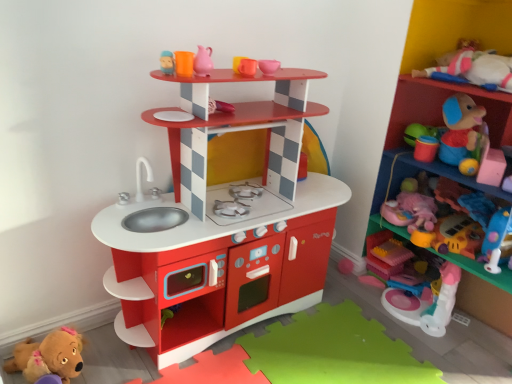
The image size is (512, 384). What do you see at coordinates (385, 254) in the screenshot? I see `translucent pink plastic blocks at lower right, which is the third toy in top-to-bottom order` at bounding box center [385, 254].

The image size is (512, 384). Find the location of `plastic toy at upper right, the 2th shelf viewed from the left`. plastic toy at upper right, the 2th shelf viewed from the left is located at coordinates (436, 126).

Describe the element at coordinates (203, 61) in the screenshot. This screenshot has height=384, width=512. I see `pink rubber jug at upper center, positioned as the 2th toy in left-to-right order` at that location.

Locate an element on the screen. The height and width of the screenshot is (384, 512). brown plush toy at lower left, placed as the 5th toy when sorted from right to left is located at coordinates (49, 356).

Locate an element on the screen. Image resolution: width=512 pixels, height=384 pixels. translucent pink plastic blocks at lower right, positioned as the third toy in bottom-to-top order is located at coordinates (385, 254).

Is matte plastic shelf at upper center, which is counted as the first shelf, starting from the left, further to the viewer compared to brown plush toy at lower left, placed as the 5th toy when sorted from right to left?

No.

Is matte plastic shelf at upper center, which is counted as the first shelf, starting from the left, not close to brown plush toy at lower left, placed as the 5th toy when sorted from right to left?

No, matte plastic shelf at upper center, which is counted as the first shelf, starting from the left, is in close proximity to brown plush toy at lower left, placed as the 5th toy when sorted from right to left.

Does matte plastic shelf at upper center, which is counted as the first shelf, starting from the left, have a smaller size compared to brown plush toy at lower left, the 1th toy when ordered from left to right?

Actually, matte plastic shelf at upper center, which is counted as the first shelf, starting from the left, might be larger than brown plush toy at lower left, the 1th toy when ordered from left to right.

Is translucent pink plastic blocks at lower right, arranged as the 4th toy when viewed from the left, facing towards brown plush toy at lower left, placed as the 5th toy when sorted from top to bottom?

No, translucent pink plastic blocks at lower right, arranged as the 4th toy when viewed from the left, is not oriented towards brown plush toy at lower left, placed as the 5th toy when sorted from top to bottom.

Does translucent pink plastic blocks at lower right, which is the 2th toy in right-to-left order, have a larger size compared to brown plush toy at lower left, which ranks as the first toy in bottom-to-top order?

No.

Considering the points (384, 274) and (26, 366), which point is behind, point (384, 274) or point (26, 366)?

Point (384, 274)

Could brown plush toy at lower left, the 1th toy when ordered from left to right, be considered to be inside translucent pink plastic blocks at lower right, which is the 2th toy in right-to-left order?

No, brown plush toy at lower left, the 1th toy when ordered from left to right, is not a part of translucent pink plastic blocks at lower right, which is the 2th toy in right-to-left order.

Can you tell me how much brown plush toy at lower left, placed as the 5th toy when sorted from right to left, and plastic toy at upper right, the 1th shelf positioned from the right, differ in facing direction?

0.815 degrees.

From a real-world perspective, is brown plush toy at lower left, which ranks as the first toy in bottom-to-top order, on plastic toy at upper right, the 2th shelf viewed from the left?

No, from a real-world perspective, brown plush toy at lower left, which ranks as the first toy in bottom-to-top order, is not over plastic toy at upper right, the 2th shelf viewed from the left

From the picture: Is plastic toy at upper right, the 2th shelf viewed from the left, inside brown plush toy at lower left, placed as the 5th toy when sorted from top to bottom?

No, plastic toy at upper right, the 2th shelf viewed from the left, is not inside brown plush toy at lower left, placed as the 5th toy when sorted from top to bottom.

Measure the distance from brown plush toy at lower left, which ranks as the first toy in bottom-to-top order, to plastic toy at upper right, the 1th shelf positioned from the right.

A distance of 4.98 feet exists between brown plush toy at lower left, which ranks as the first toy in bottom-to-top order, and plastic toy at upper right, the 1th shelf positioned from the right.

How different are the orientations of pink rubber jug at upper center, positioned as the 2th toy in left-to-right order, and plastic toy at upper right, the 2th shelf viewed from the left, in degrees?

The facing directions of pink rubber jug at upper center, positioned as the 2th toy in left-to-right order, and plastic toy at upper right, the 2th shelf viewed from the left, are 2.1 degrees apart.

Who is more distant, pink rubber jug at upper center, positioned as the 5th toy in bottom-to-top order, or plastic toy at upper right, the 1th shelf positioned from the right?

pink rubber jug at upper center, positioned as the 5th toy in bottom-to-top order, is more distant.

Is plastic toy at upper right, the 2th shelf viewed from the left, surrounded by pink rubber jug at upper center, positioned as the 5th toy in bottom-to-top order?

Definitely not — plastic toy at upper right, the 2th shelf viewed from the left, is not inside pink rubber jug at upper center, positioned as the 5th toy in bottom-to-top order.

What's the angular difference between brown plush toy at lower left, placed as the 5th toy when sorted from top to bottom, and pink plastic toy at right, the 3th toy positioned from the left,'s facing directions?

There is a 89.2-degree angle between the facing directions of brown plush toy at lower left, placed as the 5th toy when sorted from top to bottom, and pink plastic toy at right, the 3th toy positioned from the left.

Between brown plush toy at lower left, which ranks as the first toy in bottom-to-top order, and pink plastic toy at right, the 2th toy ordered from the bottom, which one appears on the left side from the viewer's perspective?

brown plush toy at lower left, which ranks as the first toy in bottom-to-top order, is more to the left.

Is brown plush toy at lower left, placed as the 5th toy when sorted from right to left, outside of pink plastic toy at right, the 3th toy positioned from the left?

Yes, brown plush toy at lower left, placed as the 5th toy when sorted from right to left, is not within pink plastic toy at right, the 3th toy positioned from the left.

From a real-world perspective, is brown plush toy at lower left, which ranks as the first toy in bottom-to-top order, physically above pink plastic toy at right, marked as the fourth toy in a top-to-bottom arrangement?

Actually, brown plush toy at lower left, which ranks as the first toy in bottom-to-top order, is physically below pink plastic toy at right, marked as the fourth toy in a top-to-bottom arrangement, in the real world.

From a real-world perspective, does brown plush toy at lower left, placed as the 5th toy when sorted from top to bottom, sit lower than pink rubber jug at upper center, positioned as the 2th toy in left-to-right order?

Yes, from a real-world perspective, brown plush toy at lower left, placed as the 5th toy when sorted from top to bottom, is under pink rubber jug at upper center, positioned as the 2th toy in left-to-right order.

Is brown plush toy at lower left, the 1th toy when ordered from left to right, looking in the opposite direction of pink rubber jug at upper center, the fourth toy viewed from the right?

No, pink rubber jug at upper center, the fourth toy viewed from the right, is not at the back of brown plush toy at lower left, the 1th toy when ordered from left to right.

Does brown plush toy at lower left, the 1th toy when ordered from left to right, have a lesser width compared to pink rubber jug at upper center, positioned as the 2th toy in left-to-right order?

Incorrect, the width of brown plush toy at lower left, the 1th toy when ordered from left to right, is not less than that of pink rubber jug at upper center, positioned as the 2th toy in left-to-right order.

From a real-world perspective, is plastic toy at upper right, the 2th shelf viewed from the left, physically below matte plastic shelf at upper center, marked as the second shelf in a right-to-left arrangement?

No.

Which of these two, plastic toy at upper right, the 2th shelf viewed from the left, or matte plastic shelf at upper center, which is counted as the first shelf, starting from the left, is wider?

plastic toy at upper right, the 2th shelf viewed from the left.

Is plastic toy at upper right, the 2th shelf viewed from the left, inside or outside of matte plastic shelf at upper center, which is counted as the first shelf, starting from the left?

plastic toy at upper right, the 2th shelf viewed from the left, cannot be found inside matte plastic shelf at upper center, which is counted as the first shelf, starting from the left.

Is plastic toy at upper right, the 1th shelf positioned from the right, looking in the opposite direction of matte plastic shelf at upper center, marked as the second shelf in a right-to-left arrangement?

plastic toy at upper right, the 1th shelf positioned from the right, is not turned away from matte plastic shelf at upper center, marked as the second shelf in a right-to-left arrangement.

From a real-world perspective, which shelf is the 1st one above the brown plush toy at lower left, the 1th toy when ordered from left to right? Please provide its 2D coordinates.

[(221, 223)]

Locate an element on the screen. the 3rd toy counting from the left side of the translucent pink plastic blocks at lower right, which is the third toy in top-to-bottom order is located at coordinates [49, 356].

Based on their spatial positions, is translucent pink plastic blocks at lower right, which is the third toy in top-to-bottom order, or matte plastic shelf at upper center, marked as the second shelf in a right-to-left arrangement, closer to brown plush toy at lower left, placed as the 5th toy when sorted from top to bottom?

The object closer to brown plush toy at lower left, placed as the 5th toy when sorted from top to bottom, is matte plastic shelf at upper center, marked as the second shelf in a right-to-left arrangement.

Considering their positions, is pink plastic toy at right, marked as the fourth toy in a top-to-bottom arrangement, positioned further to plastic toy at upper right, the 1th shelf positioned from the right, than matte plastic shelf at upper center, marked as the second shelf in a right-to-left arrangement?

The object further to plastic toy at upper right, the 1th shelf positioned from the right, is matte plastic shelf at upper center, marked as the second shelf in a right-to-left arrangement.

Based on the photo, based on their spatial positions, is matte plastic shelf at upper center, marked as the second shelf in a right-to-left arrangement, or pink plush toy at right, the 5th toy viewed from the left, further from translucent pink plastic blocks at lower right, which is the third toy in top-to-bottom order?

matte plastic shelf at upper center, marked as the second shelf in a right-to-left arrangement, is further to translucent pink plastic blocks at lower right, which is the third toy in top-to-bottom order.

Which object lies further to the anchor point plastic toy at upper right, the 2th shelf viewed from the left, pink rubber jug at upper center, positioned as the 2th toy in left-to-right order, or brown plush toy at lower left, the 1th toy when ordered from left to right?

brown plush toy at lower left, the 1th toy when ordered from left to right, lies further to plastic toy at upper right, the 2th shelf viewed from the left, than the other object.

Looking at this image, when comparing their distances from pink plush toy at right, positioned as the second toy in top-to-bottom order, does brown plush toy at lower left, placed as the 5th toy when sorted from right to left, or plastic toy at upper right, the 2th shelf viewed from the left, seem further?

Among the two, brown plush toy at lower left, placed as the 5th toy when sorted from right to left, is located further to pink plush toy at right, positioned as the second toy in top-to-bottom order.

Considering their positions, is matte plastic shelf at upper center, which is counted as the first shelf, starting from the left, positioned further to pink rubber jug at upper center, placed as the 1th toy when sorted from top to bottom, than brown plush toy at lower left, placed as the 5th toy when sorted from top to bottom?

brown plush toy at lower left, placed as the 5th toy when sorted from top to bottom.

In the scene shown: Based on their spatial positions, is pink rubber jug at upper center, positioned as the 2th toy in left-to-right order, or matte plastic shelf at upper center, which is counted as the first shelf, starting from the left, further from pink plastic toy at right, the 3th toy in the right-to-left sequence?

pink rubber jug at upper center, positioned as the 2th toy in left-to-right order, is further to pink plastic toy at right, the 3th toy in the right-to-left sequence.

From the picture: Based on their spatial positions, is translucent pink plastic blocks at lower right, arranged as the 4th toy when viewed from the left, or plastic toy at upper right, the 1th shelf positioned from the right, closer to pink rubber jug at upper center, positioned as the 5th toy in bottom-to-top order?

Based on the image, plastic toy at upper right, the 1th shelf positioned from the right, appears to be nearer to pink rubber jug at upper center, positioned as the 5th toy in bottom-to-top order.

Where is `toy between pink rubber jug at upper center, placed as the 1th toy when sorted from top to bottom, and translucent pink plastic blocks at lower right, which is the 2th toy in right-to-left order`? The width and height of the screenshot is (512, 384). toy between pink rubber jug at upper center, placed as the 1th toy when sorted from top to bottom, and translucent pink plastic blocks at lower right, which is the 2th toy in right-to-left order is located at coordinates (426, 303).

At what (x,y) coordinates should I click in order to perform the action: click on shelf between pink rubber jug at upper center, the fourth toy viewed from the right, and pink plastic toy at right, the 3th toy positioned from the left. Please return your answer as a coordinate pair (x, y). Looking at the image, I should click on (221, 223).

At what (x,y) coordinates should I click in order to perform the action: click on shelf between pink rubber jug at upper center, placed as the 1th toy when sorted from top to bottom, and plastic toy at upper right, the 2th shelf viewed from the left, in the horizontal direction. Please return your answer as a coordinate pair (x, y). Image resolution: width=512 pixels, height=384 pixels. Looking at the image, I should click on (221, 223).

Where is `shelf between pink rubber jug at upper center, the fourth toy viewed from the right, and pink plush toy at right, acting as the 1th toy starting from the right`? shelf between pink rubber jug at upper center, the fourth toy viewed from the right, and pink plush toy at right, acting as the 1th toy starting from the right is located at coordinates (221, 223).